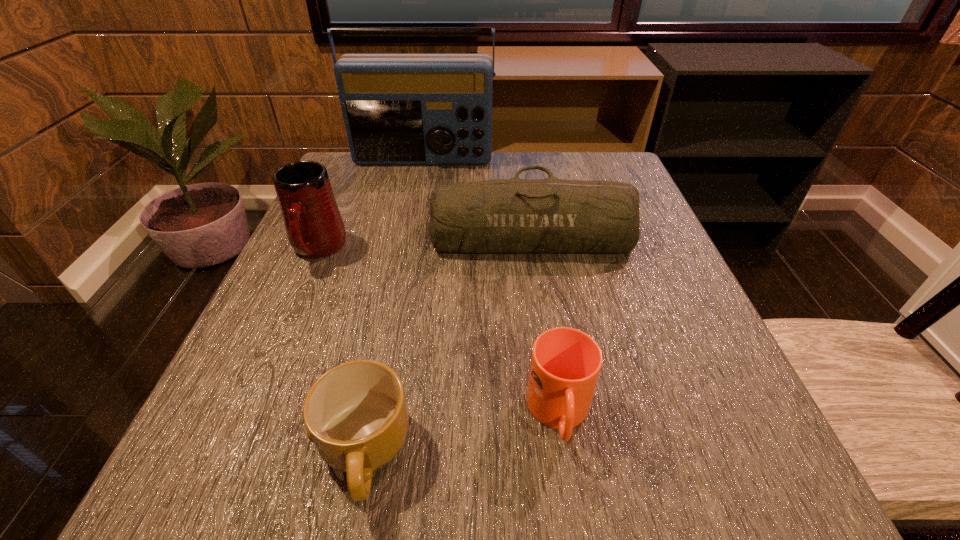
You are a GUI agent. You are given a task and a screenshot of the screen. Output one action in this format:
    pyautogui.click(x=<x>, y=<y>)
    Task: Click on the free spot between the shortest object and the leftmost mug
    
    Given the screenshot: What is the action you would take?
    pyautogui.click(x=341, y=351)

Identify the location of empty space between the farthest mug and the duffel bag. The height and width of the screenshot is (540, 960). (424, 242).

The width and height of the screenshot is (960, 540). Find the location of `free point between the shortest mug and the rightmost mug`. free point between the shortest mug and the rightmost mug is located at coordinates (462, 433).

At what (x,y) coordinates should I click in order to perform the action: click on free space between the rightmost mug and the shortest object. Please return your answer as a coordinate pair (x, y). Looking at the image, I should click on (462, 433).

I want to click on object that is the second closest to the second mug from left to right, so click(314, 226).

Image resolution: width=960 pixels, height=540 pixels. In order to click on object that is the second nearest to the radio receiver in this screenshot , I will do `click(314, 226)`.

Image resolution: width=960 pixels, height=540 pixels. I want to click on mug that is the third nearest to the farthest object, so point(356,414).

Locate an element on the screen. The height and width of the screenshot is (540, 960). mug that stands as the closest to the shortest mug is located at coordinates (565, 365).

This screenshot has width=960, height=540. Find the location of `vacant position in the image that satisfies the following two spatial constraints: 1. on the front panel of the radio receiver; 2. on the left side of the duffel bag`. vacant position in the image that satisfies the following two spatial constraints: 1. on the front panel of the radio receiver; 2. on the left side of the duffel bag is located at coordinates (407, 236).